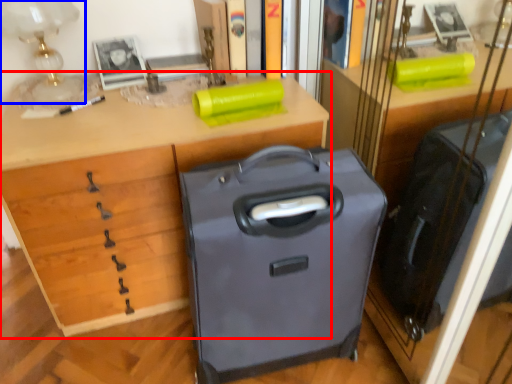
Question: Which point is further to the camera, desk (highlighted by a red box) or table lamp (highlighted by a blue box)?

Choices:
 (A) desk
 (B) table lamp

Answer: (B)